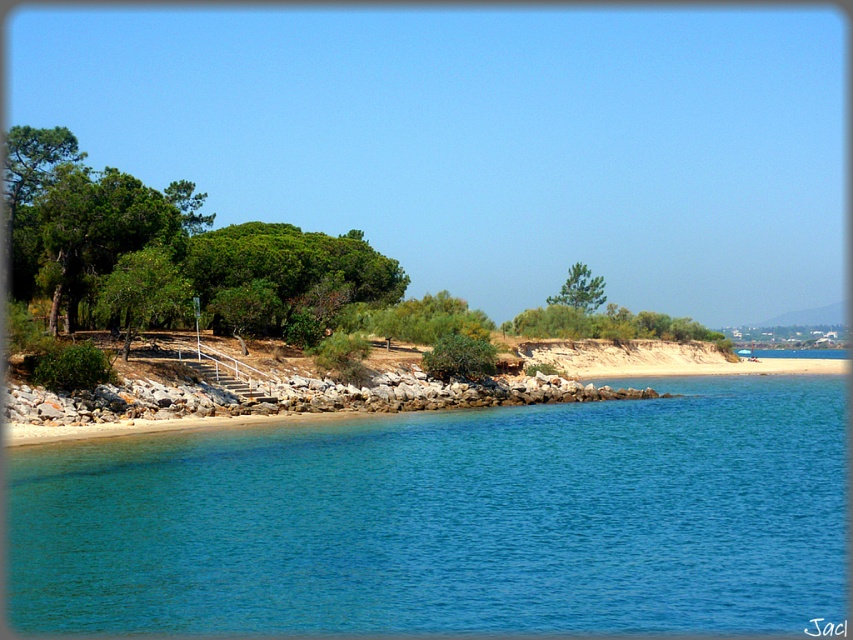
Question: Which object is farther from the camera taking this photo?

Choices:
 (A) smooth sand beach at lower center
 (B) green leafy trees at left

Answer: (B)

Question: Is green leafy trees at left further to camera compared to green textured tree at center?

Choices:
 (A) yes
 (B) no

Answer: (B)

Question: Can you confirm if clear blue water at lower left is thinner than green textured tree at center?

Choices:
 (A) no
 (B) yes

Answer: (A)

Question: Among these points, which one is farthest from the camera?

Choices:
 (A) (234, 445)
 (B) (73, 323)

Answer: (B)

Question: From the image, what is the correct spatial relationship of smooth sand beach at lower center in relation to green textured tree at center?

Choices:
 (A) below
 (B) above

Answer: (A)

Question: Which point appears farthest from the camera in this image?

Choices:
 (A) (126, 433)
 (B) (567, 284)
 (C) (577, 493)
 (D) (26, 198)

Answer: (B)